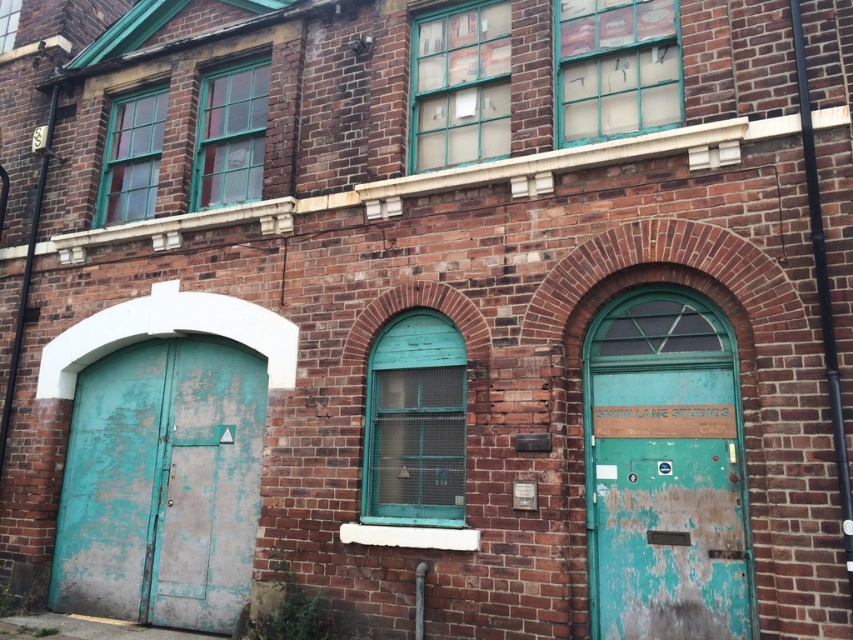
You are a painter assessing the building. You need to determine which door is lower in position between the peeling teal metal door at left and the peeling teal paint door at center right. Which one is lower?

The peeling teal metal door at left is positioned under the peeling teal paint door at center right, so it is lower in position.

You are a painter who needs to move a ladder from the peeling teal metal door at left to the peeling teal paint door at center right. The ladder is 12 feet long. Can you safely move the ladder horizontally between them without tilting it?

The distance between the peeling teal metal door at left and the peeling teal paint door at center right is 11.90 feet. Since the ladder is 12 feet long, it can be safely moved horizontally between them without tilting as the distance is slightly less than the ladder length.

You are standing in front of a historic building and want to enter through the peeling teal metal door at left. If the door is 18.19 feet away from you, can you reach it without moving closer?

The peeling teal metal door at left is 18.19 feet away from the viewer, so you cannot reach it without moving closer since it is too far.